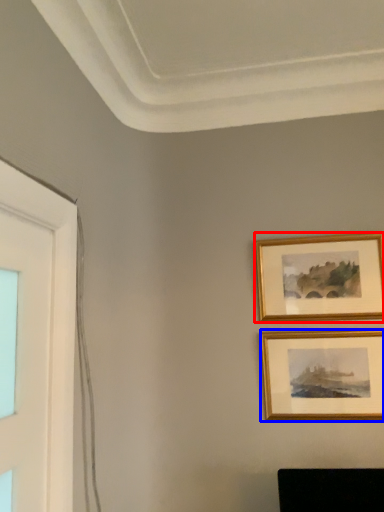
Question: Which object appears closest to the camera in this image, picture frame (highlighted by a red box) or picture frame (highlighted by a blue box)?

Choices:
 (A) picture frame
 (B) picture frame

Answer: (B)